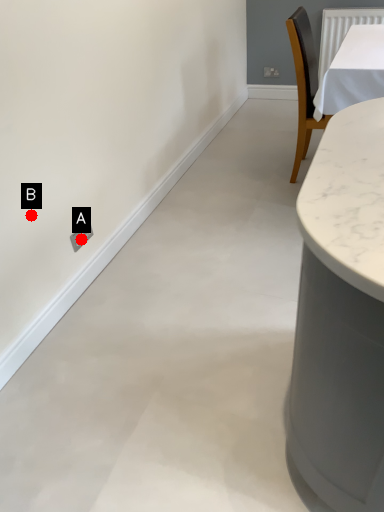
Question: Two points are circled on the image, labeled by A and B beside each circle. Among these points, which one is farthest from the camera?

Choices:
 (A) A is further
 (B) B is further

Answer: (A)